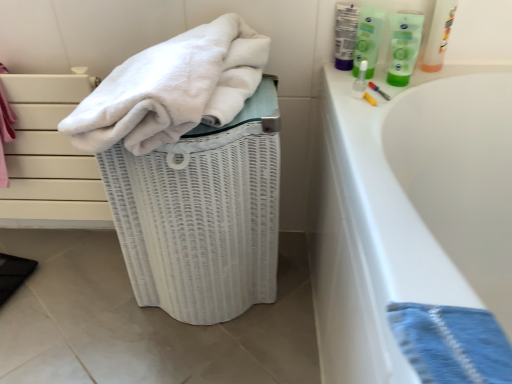
Question: Based on their positions, is green plastic tube at upper right located to the left or right of green plastic bottle at upper right?

Choices:
 (A) left
 (B) right

Answer: (B)

Question: Considering the positions of green plastic tube at upper right and green plastic bottle at upper right in the image, is green plastic tube at upper right bigger or smaller than green plastic bottle at upper right?

Choices:
 (A) small
 (B) big

Answer: (A)

Question: Which object is the farthest from the white matte drawer at left?

Choices:
 (A) white soft towel at upper left
 (B) green plastic bottle at upper right
 (C) white wicker laundry basket at left
 (D) green plastic tube at upper right
 (E) blue woven towel at lower right

Answer: (E)

Question: Which object is positioned closest to the green plastic bottle at upper right?

Choices:
 (A) green plastic tube at upper right
 (B) white wicker laundry basket at left
 (C) white matte drawer at left
 (D) white soft towel at upper left
 (E) blue woven towel at lower right

Answer: (A)